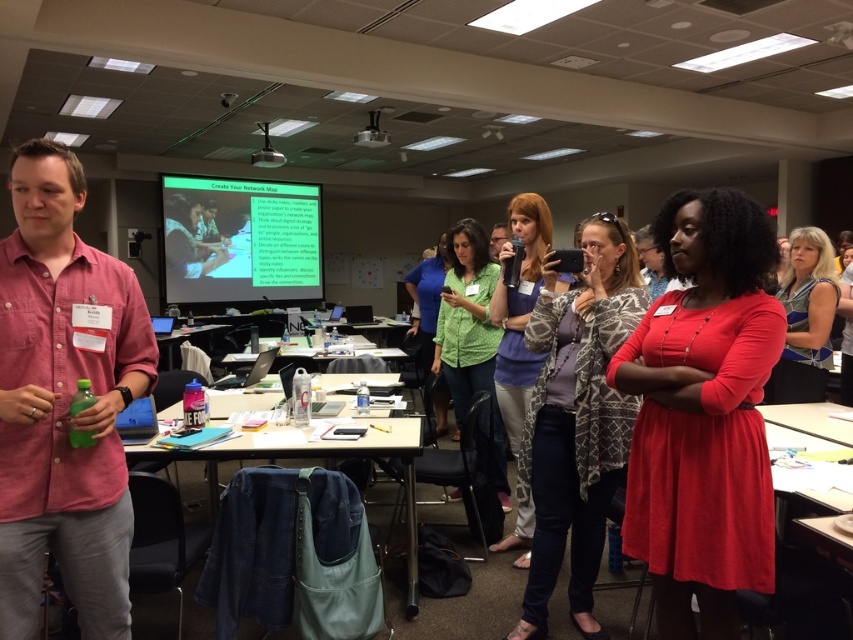
You are organizing a workshop and need to ensure that the metallic projector at upper center can fit through a doorway that is the same width as the blue striped blouse at center. Based on the scene description, will the projector fit through the doorway?

The blue striped blouse at center is wider than the metallic projector at upper center. Since the doorway is the same width as the blouse, the projector will fit through the doorway as it is narrower.

You are standing in the conference room and see the denim fabric at lower center. If you want to reach it, which direction should you move relative to your current position?

The denim fabric at lower center is located at point (331, 456). Since it is at lower center, you should move forward and slightly to the right to reach it.